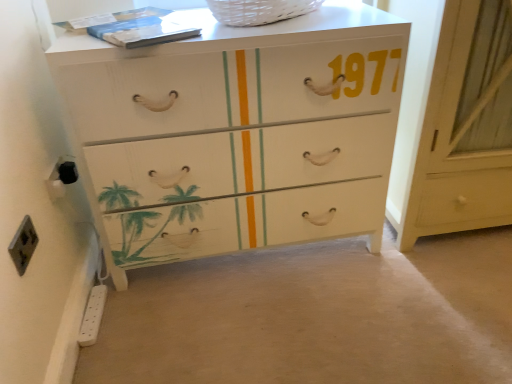
Question: Looking at the image, does white plastic power strip at lower left, the 3th electric outlet viewed from the front, seem bigger or smaller compared to white wood cabinet at right?

Choices:
 (A) big
 (B) small

Answer: (B)

Question: Considering their positions, is white plastic power strip at lower left, the 3th electric outlet positioned from the top, located in front of or behind white wood cabinet at right?

Choices:
 (A) front
 (B) behind

Answer: (B)

Question: Estimate the real-world distances between objects in this image. Which object is farther from the white wood cabinet at right?

Choices:
 (A) black plastic socket at lower left, the 2th electric outlet when ordered from front to back
 (B) white plastic power strip at lower left, which ranks as the 1th electric outlet in back-to-front order
 (C) white wicker basket at upper center
 (D) white painted wood chest of drawers at center
 (E) black plastic outlet at lower left, the 2th electric outlet viewed from the top

Answer: (E)

Question: Based on their relative distances, which object is farther from the black plastic socket at lower left, the 2th electric outlet in the back-to-front sequence?

Choices:
 (A) white wicker basket at upper center
 (B) white wood cabinet at right
 (C) black plastic outlet at lower left, positioned as the second electric outlet in bottom-to-top order
 (D) white painted wood chest of drawers at center
 (E) white plastic power strip at lower left, placed as the 1th electric outlet when sorted from bottom to top

Answer: (B)